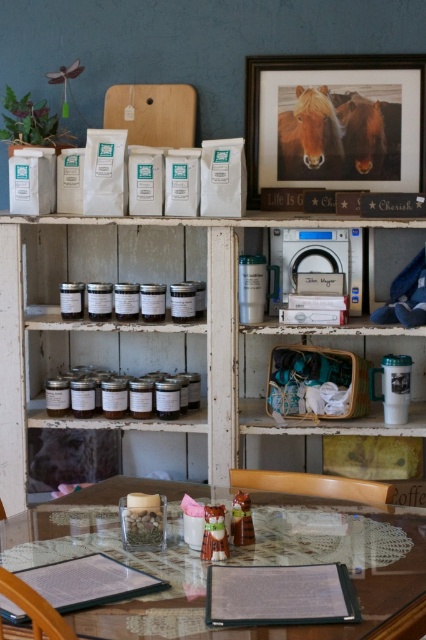
You are standing in the rustic shop and want to place a new item on the shelf. The wooden framed picture at upper center is currently at position coordinates 0.191 on the x and 0.786 on the y. If you want to place an item to the right of it, where should you place it in terms of x and y coordinates?

To place an item to the right of the wooden framed picture at upper center, you should adjust the x coordinate to be higher than 0.191 while keeping the y coordinate around 0.786. For example, placing it at approximately x 0.25 and y 0.786 would be to the right.

You are standing in the rustic shop and want to reach both points marked as point (209, 429) and point (304, 128). Which point should you approach first to reach the one that is closer to you?

Point (209, 429) is in front of point (304, 128), so you should approach point (209, 429) first as it is closer to you.

You are organizing a display in the shop and need to know which object takes up more space between the white wood pantry at center and the wooden framed picture at upper center. Which one requires more space?

The white wood pantry at center requires more space because it is larger in size than the wooden framed picture at upper center.